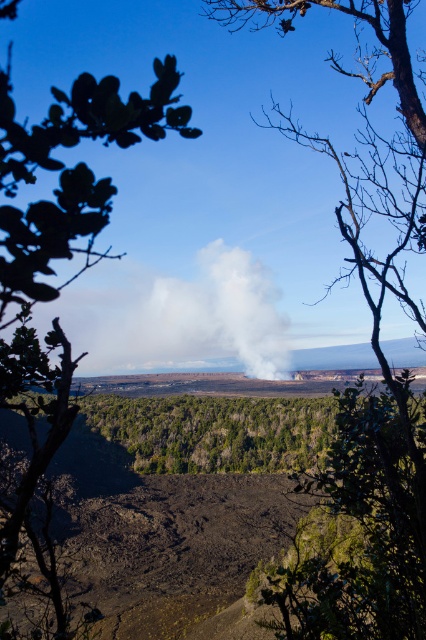
In the scene shown: You are a hiker standing at the edge of the volcanic crater. You see the bare branches at center and the green leafy tree at upper left. Which object is closer to you?

The bare branches at center are closer to you because the green leafy tree at upper left is positioned behind them.

From the picture: You are a hiker who wants to take a photo of the green leafy tree at upper left and the bare branches at center. Which object should you focus on first if you want to capture both in a single frame without moving the camera?

The bare branches at center is wider than the green leafy tree at upper left, so you should focus on the bare branches at center first to ensure it fits within the frame.